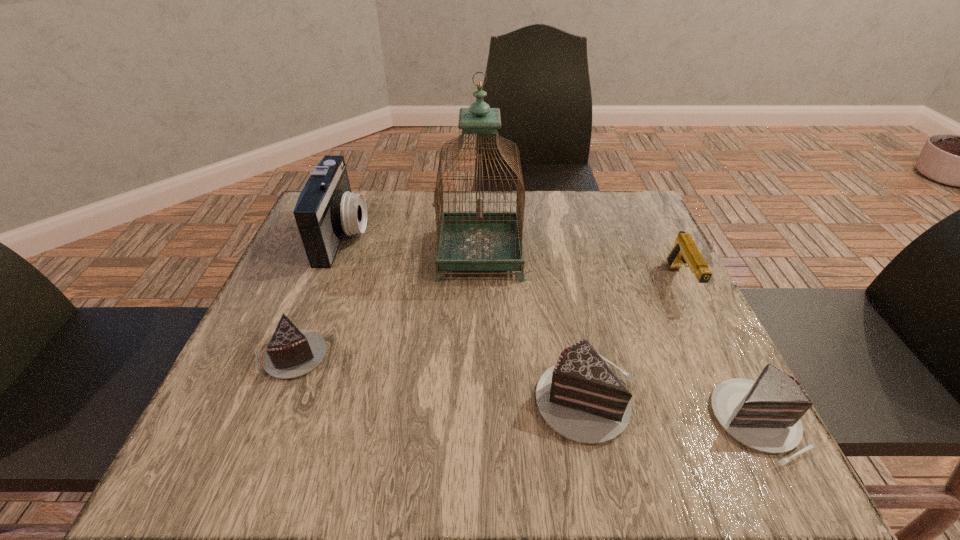
Identify the location of the leftmost chocolate cake. click(x=291, y=352).

You are a GUI agent. You are given a task and a screenshot of the screen. Output one action in this format:
    pyautogui.click(x=<x>, y=<y>)
    Task: Click on the shortest chocolate cake
    The height and width of the screenshot is (540, 960).
    Given the screenshot: What is the action you would take?
    pyautogui.click(x=291, y=352)

In order to click on the second chocolate cake from right to left in this screenshot , I will do `click(581, 398)`.

Where is `the second tallest chocolate cake`? the second tallest chocolate cake is located at coordinates (764, 415).

This screenshot has width=960, height=540. Identify the location of the rightmost chocolate cake. (764, 415).

Find the location of a particular element. Image resolution: width=960 pixels, height=540 pixels. the tallest object is located at coordinates (479, 240).

Image resolution: width=960 pixels, height=540 pixels. Find the location of `camcorder`. camcorder is located at coordinates (326, 209).

Find the location of `pistol`. pistol is located at coordinates (685, 252).

Find the location of a particular element. Image resolution: width=960 pixels, height=540 pixels. vacant area situated 0.230m on the right of the leftmost chocolate cake is located at coordinates (448, 355).

Where is `vacant area located 0.050m on the left of the second chocolate cake from right to left`? This screenshot has height=540, width=960. vacant area located 0.050m on the left of the second chocolate cake from right to left is located at coordinates (506, 398).